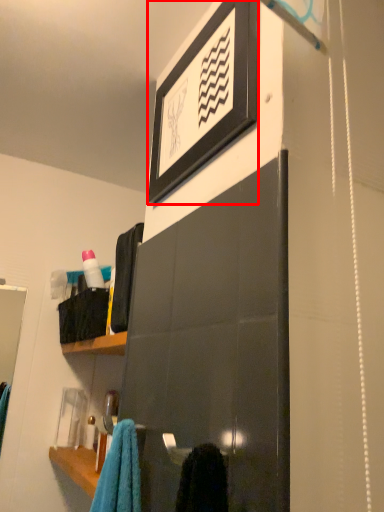
Question: From the image's perspective, what is the correct spatial positioning of picture frame (annotated by the red box) in reference to bottle?

Choices:
 (A) below
 (B) above

Answer: (B)